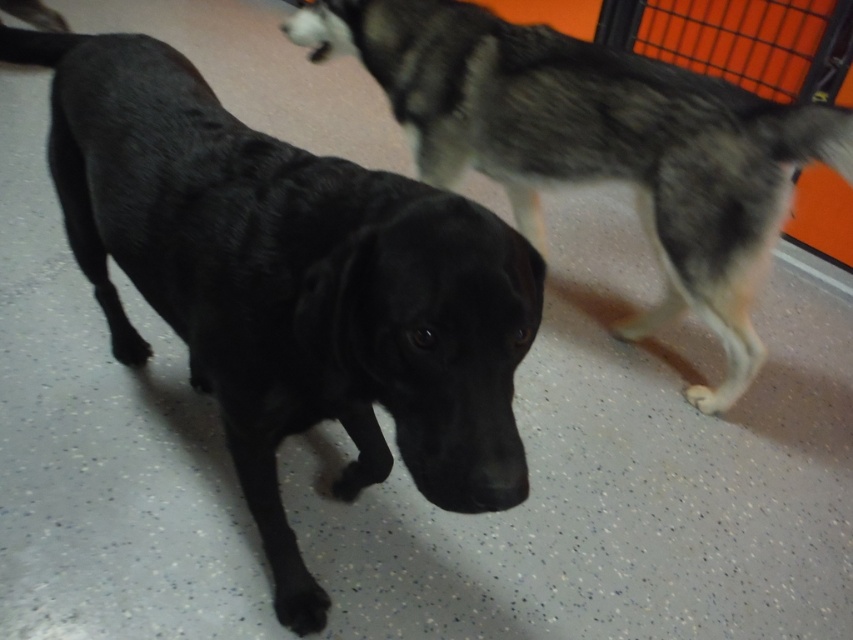
Question: Is black matte dog at center positioned in front of black fur dog at center?

Choices:
 (A) yes
 (B) no

Answer: (A)

Question: Is black matte dog at center to the right of black fur dog at center from the viewer's perspective?

Choices:
 (A) no
 (B) yes

Answer: (A)

Question: Does black matte dog at center have a lesser width compared to black fur dog at center?

Choices:
 (A) no
 (B) yes

Answer: (B)

Question: Among these objects, which one is farthest from the camera?

Choices:
 (A) black fur dog at center
 (B) black matte dog at center

Answer: (A)

Question: Which object is closer to the camera taking this photo?

Choices:
 (A) black matte dog at center
 (B) black fur dog at center

Answer: (A)